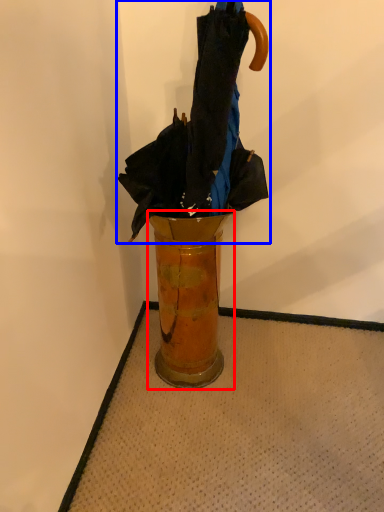
Question: Which object appears closest to the camera in this image, vase (highlighted by a red box) or umbrella (highlighted by a blue box)?

Choices:
 (A) vase
 (B) umbrella

Answer: (B)